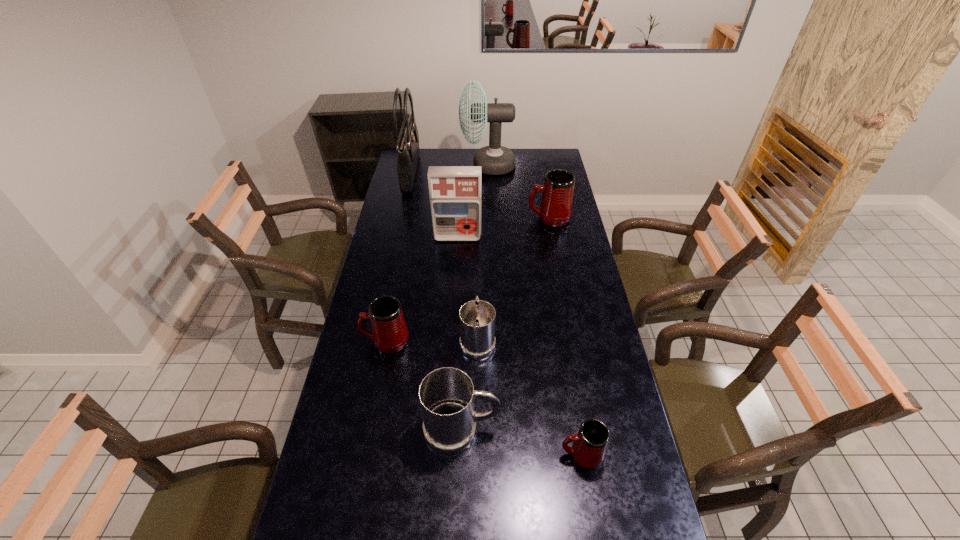
Image resolution: width=960 pixels, height=540 pixels. I want to click on fan, so click(494, 159).

Identify the location of handbag. (407, 146).

The image size is (960, 540). What are the coordinates of `the first-aid kit` in the screenshot? It's located at (455, 191).

Identify the location of the fourth farthest object. (455, 191).

This screenshot has width=960, height=540. In order to click on the third farthest object in this screenshot , I will do `click(556, 204)`.

Identify the location of the farthest red mug. (556, 204).

At what (x,y) coordinates should I click in order to perform the action: click on the nearer gray mug. Please return your answer as a coordinate pair (x, y). The image size is (960, 540). Looking at the image, I should click on (447, 394).

Where is `the second farthest red mug`? This screenshot has width=960, height=540. the second farthest red mug is located at coordinates (389, 332).

Locate an element on the screen. Image resolution: width=960 pixels, height=540 pixels. the leftmost red mug is located at coordinates (389, 332).

Locate an element on the screen. The width and height of the screenshot is (960, 540). the farther gray mug is located at coordinates (477, 317).